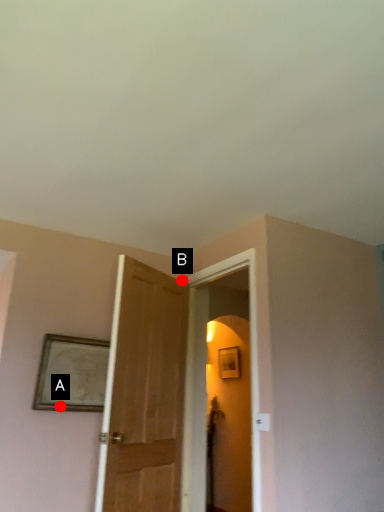
Question: Two points are circled on the image, labeled by A and B beside each circle. Which point is farther to the camera?

Choices:
 (A) A is further
 (B) B is further

Answer: (B)